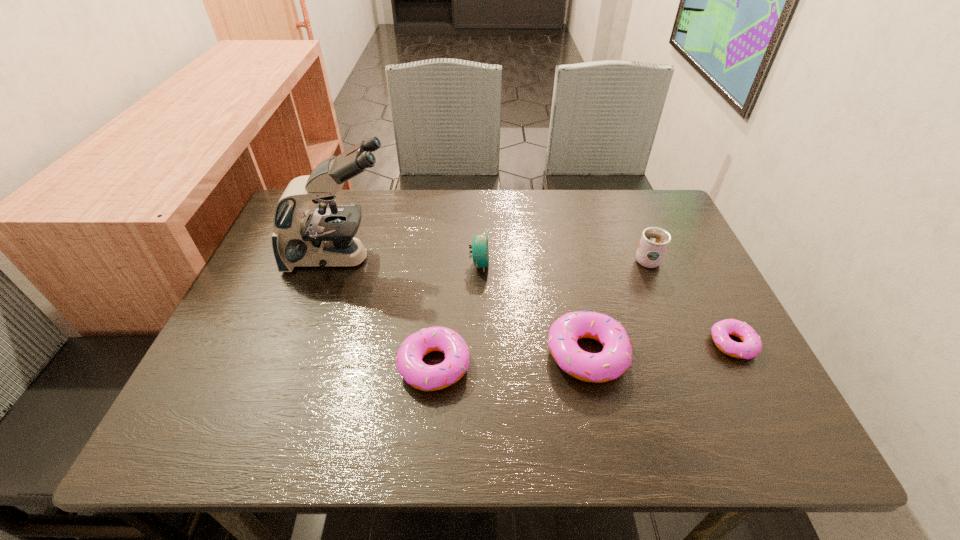
Please point out where to position a new doughnut on the left to maintain spacing. Please provide its 2D coordinates. Your answer should be formatted as a tuple, i.e. [(x, y)], where the tuple contains the x and y coordinates of a point satisfying the conditions above.

[(276, 376)]